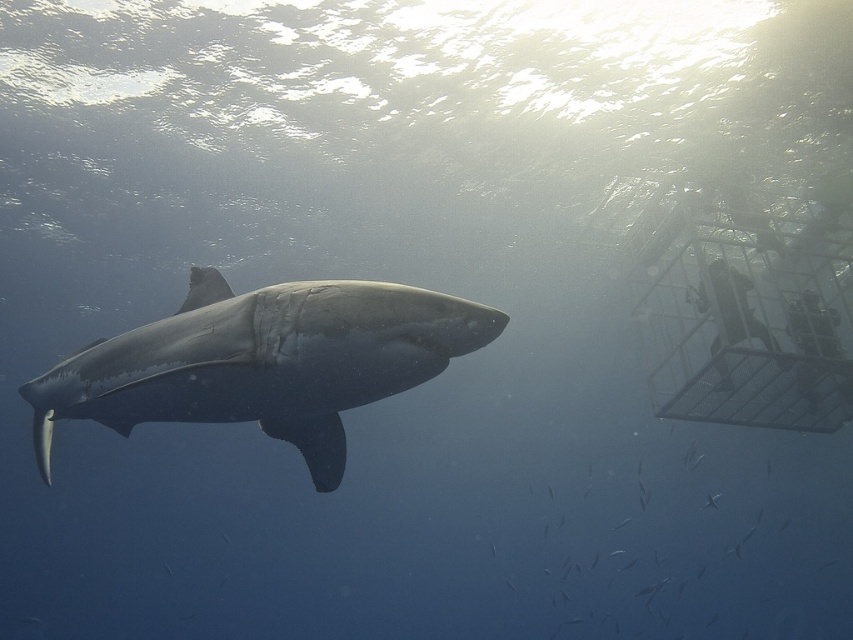
You are a marine biologist observing the underwater scene. You need to determine if the metallic silver cage at right can safely contain the shiny gray shark at center. Based on their sizes, what is your conclusion?

The shiny gray shark at center is larger in size than the metallic silver cage at right, so the cage cannot safely contain the shark.

You are a marine biologist observing the underwater scene. You need to determine if the shiny gray shark at center can reach the metallic silver birdcage at right within 3 seconds. Assume the shark swims at a constant speed of 4 meters per second. Can it reach the cage in that time?

The distance between the shiny gray shark at center and the metallic silver birdcage at right is 6.57 meters. At a speed of 4 meters per second, the shark would take approximately 1.64 seconds to cover that distance. Since 1.64 seconds is less than 3 seconds, the shark can reach the cage in time.